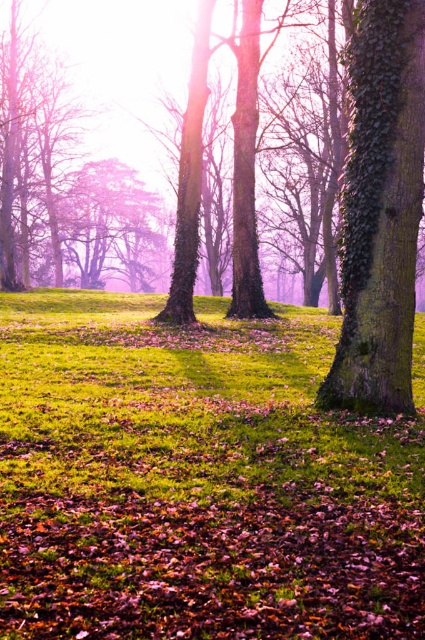
Is green grassy at center closer to camera compared to green mossy tree trunk at center?

Yes, it is.

Locate an element on the screen. This screenshot has width=425, height=640. green grassy at center is located at coordinates (198, 477).